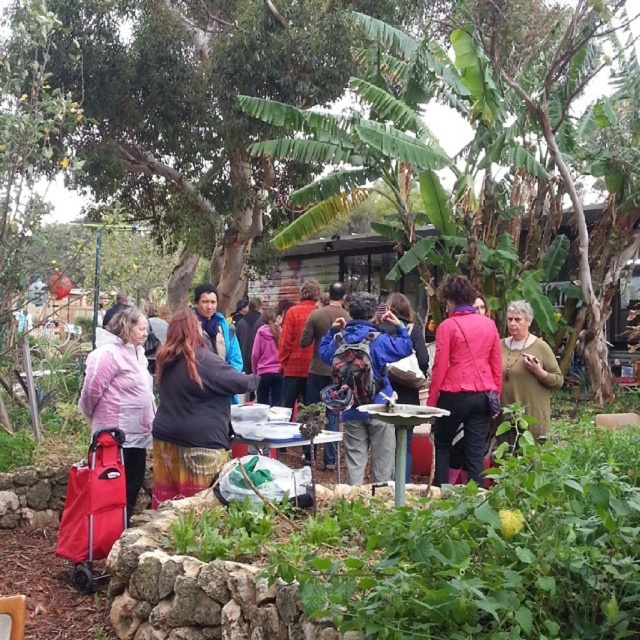
You are organizing a community event and need to place a sign on a table. The sign must be placed between the blue backpack at center and the green textured sweater at center. Which object should the sign be closer to if you want it to be closer to the larger item?

The sign should be closer to the blue backpack at center because it is larger than the green textured sweater at center.

You are a photographer trying to capture a photo of the matte black jacket at center and the white plastic picnic table at center. Since you want to focus on the jacket, which object should you position closer to the camera?

The matte black jacket at center is located above the white plastic picnic table at center, so to focus on the jacket, you should position the matte black jacket at center closer to the camera.

You are standing at the origin point of the coordinate system in the image. You want to walk to the matte black jacket at center. Which direction should you move in to reach it?

The matte black jacket at center is located at point 0.594 on the x axis and 0.728 on the y axis. Since the origin is at the bottom left corner, you should move to the right and upwards to reach it.